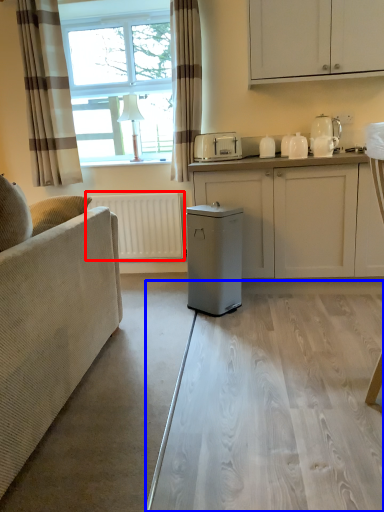
Question: Which point is closer to the camera, radiator (highlighted by a red box) or glass table (highlighted by a blue box)?

Choices:
 (A) radiator
 (B) glass table

Answer: (B)